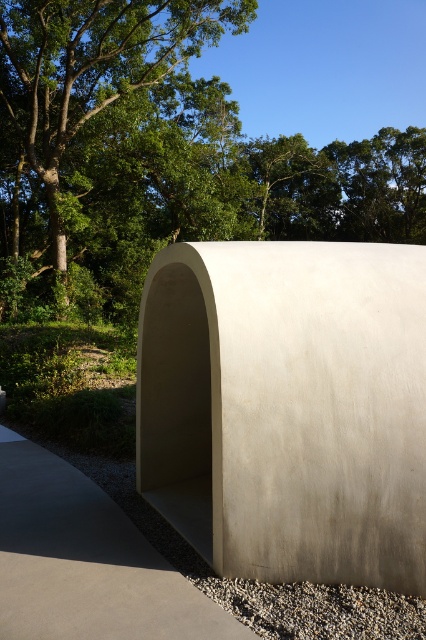
Question: Can you confirm if green leafy tree at upper left is bigger than gray gravel at lower center?

Choices:
 (A) no
 (B) yes

Answer: (B)

Question: Can you confirm if white concrete shelter at center is wider than gray gravel at lower center?

Choices:
 (A) yes
 (B) no

Answer: (A)

Question: Which of these objects is positioned closest to the smooth concrete bench at center?

Choices:
 (A) green leafy tree at upper left
 (B) gray gravel at lower center
 (C) white concrete shelter at center

Answer: (B)

Question: Which of the following is the closest to the observer?

Choices:
 (A) smooth concrete bench at center
 (B) green leafy tree at upper left
 (C) gray gravel at lower center
 (D) white concrete shelter at center

Answer: (A)

Question: Which point is closer to the camera?

Choices:
 (A) (x=230, y=621)
 (B) (x=57, y=204)
 (C) (x=264, y=502)

Answer: (A)

Question: Does green leafy tree at upper left have a lesser width compared to gray gravel at lower center?

Choices:
 (A) yes
 (B) no

Answer: (B)